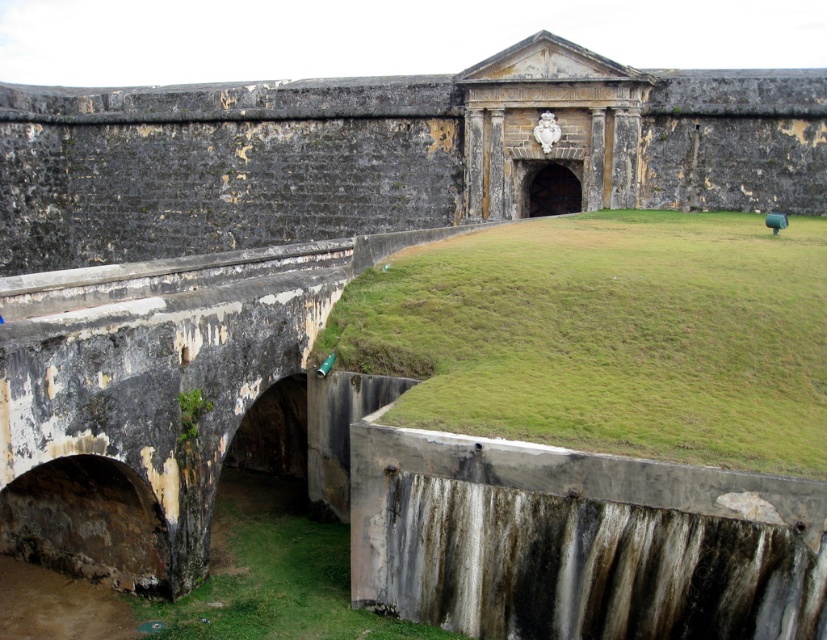
Question: Does green grass at lower right appear on the right side of green grass at lower left?

Choices:
 (A) yes
 (B) no

Answer: (A)

Question: Is green grass at lower right bigger than green grass at lower left?

Choices:
 (A) yes
 (B) no

Answer: (A)

Question: Which point is closer to the camera?

Choices:
 (A) (505, 246)
 (B) (213, 545)

Answer: (B)

Question: Can you confirm if green grass at lower right is positioned to the left of green grass at lower left?

Choices:
 (A) yes
 (B) no

Answer: (B)